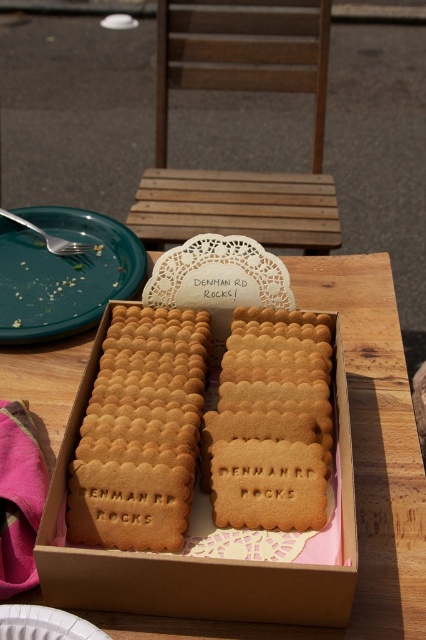
Is green matte plate at left above white paper plate at lower left?

Indeed, green matte plate at left is positioned over white paper plate at lower left.

Is point (8, 321) positioned in front of point (25, 614)?

That is False.

The height and width of the screenshot is (640, 426). Identify the location of green matte plate at left. (63, 273).

Is point (227, 419) positioned before point (9, 301)?

Yes, it is in front of point (9, 301).

This screenshot has height=640, width=426. In order to click on golden matte biscuit at center in this screenshot , I will do `click(270, 422)`.

Where is `golden matte biscuit at center`? This screenshot has height=640, width=426. golden matte biscuit at center is located at coordinates (270, 422).

I want to click on brown cardboard box at center, so pyautogui.click(x=196, y=557).

Which of these two, brown cardboard box at center or green matte plate at left, stands taller?

Standing taller between the two is brown cardboard box at center.

Is point (270, 621) in front of point (77, 273)?

Yes, it is.

At what (x,y) coordinates should I click in order to perform the action: click on brown cardboard box at center. Please return your answer as a coordinate pair (x, y). Image resolution: width=426 pixels, height=640 pixels. Looking at the image, I should click on (196, 557).